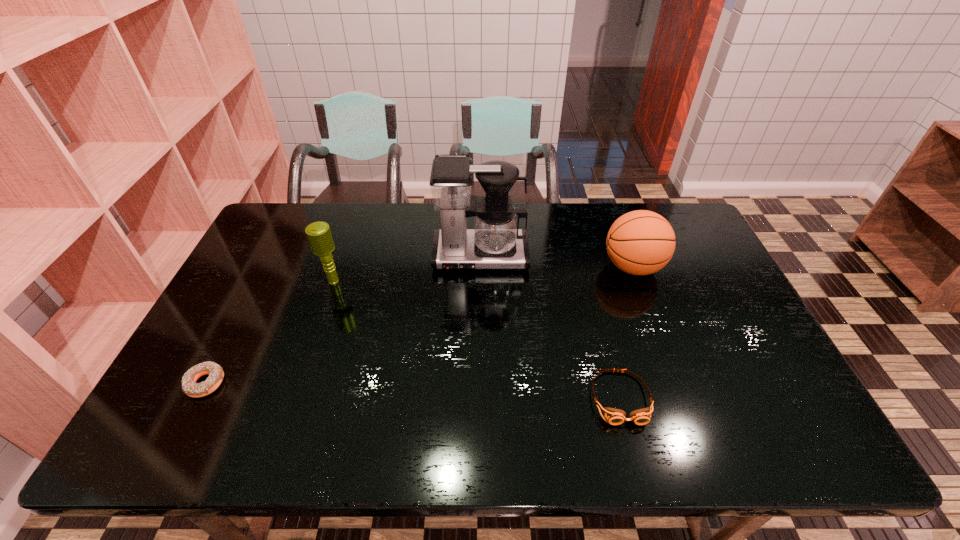
This screenshot has height=540, width=960. Identify the location of free space between the leftmost object and the second shortest object. (413, 390).

Find the location of a particular element. empty space between the third object from right to left and the basketball is located at coordinates (557, 261).

Find the location of `empty location between the shortest object and the basketball`. empty location between the shortest object and the basketball is located at coordinates (x=420, y=325).

At what (x,y) coordinates should I click in order to perform the action: click on vacant point located between the microphone and the tallest object. Please return your answer as a coordinate pair (x, y). This screenshot has height=540, width=960. Looking at the image, I should click on (407, 269).

This screenshot has height=540, width=960. I want to click on empty location between the doughnut and the microphone, so click(x=270, y=332).

Where is `vacant space in between the microphone and the coffee maker`? Image resolution: width=960 pixels, height=540 pixels. vacant space in between the microphone and the coffee maker is located at coordinates (407, 269).

The width and height of the screenshot is (960, 540). I want to click on vacant space in between the fourth tallest object and the shortest object, so click(413, 390).

The height and width of the screenshot is (540, 960). I want to click on vacant space that's between the basketball and the goggles, so click(x=626, y=332).

Identify the location of vacant space that is in between the third object from left to right and the microphone. (407, 269).

Identify which object is the third closest to the second object from left to right. Please provide its 2D coordinates. Your answer should be formatted as a tuple, i.e. [(x, y)], where the tuple contains the x and y coordinates of a point satisfying the conditions above.

[(614, 416)]